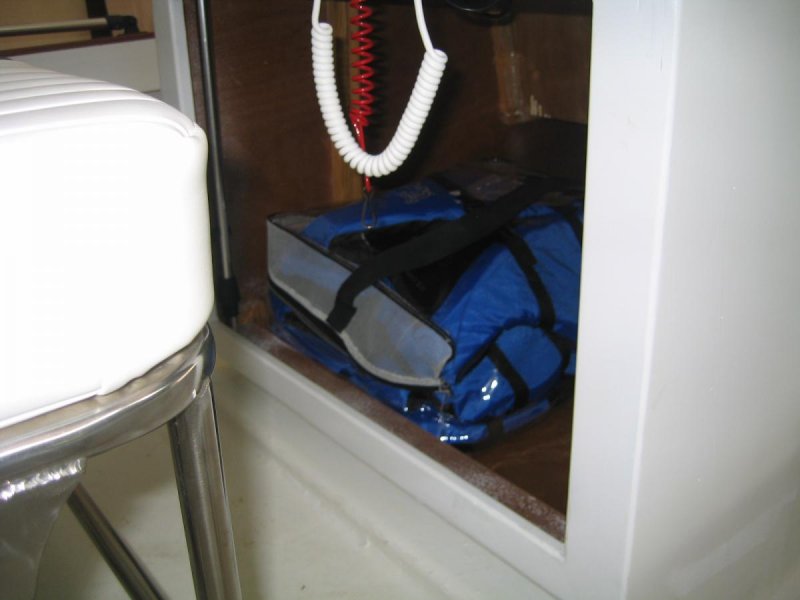
In order to click on white coiled cable in this screenshot , I will do `click(362, 157)`.